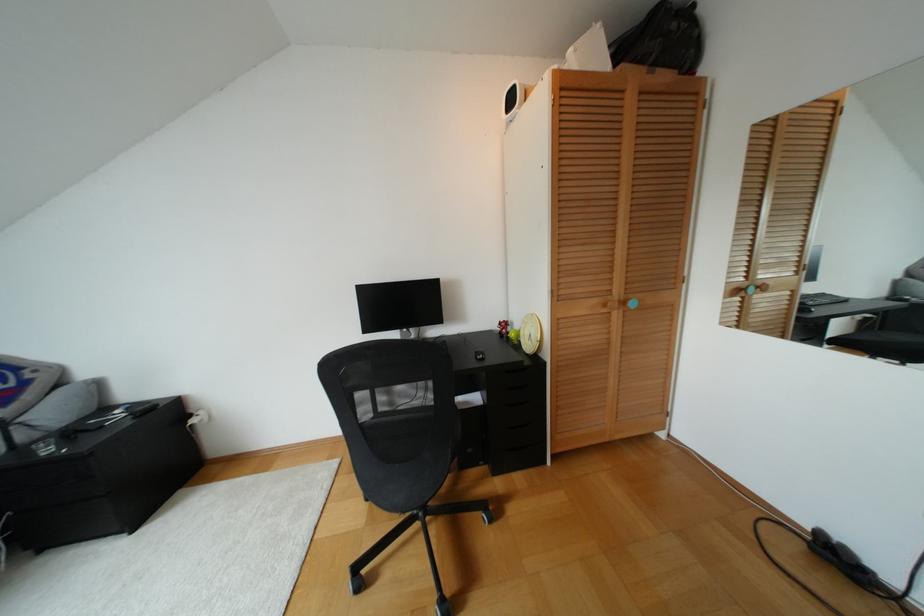
Locate an element on the screen. black drawer handle is located at coordinates (525, 370).